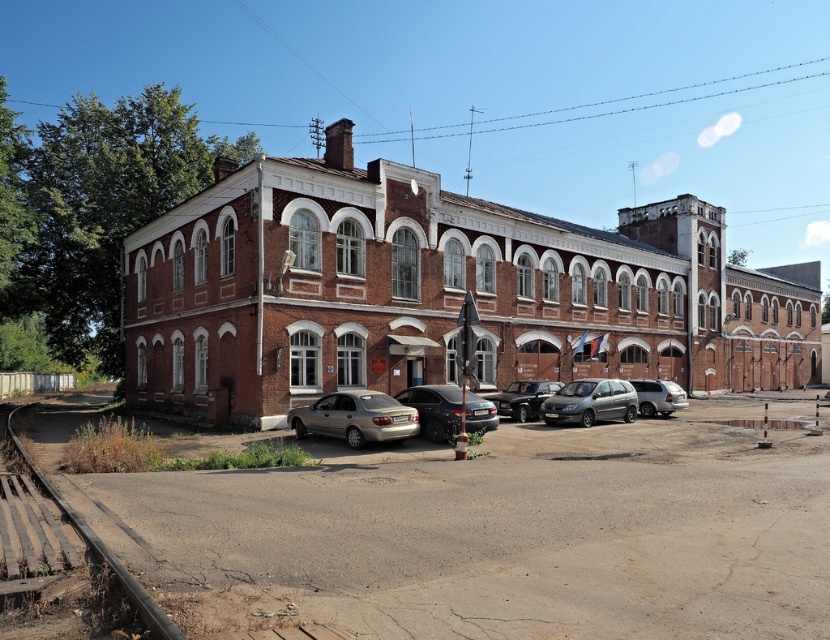
This screenshot has height=640, width=830. Describe the element at coordinates (433, 410) in the screenshot. I see `satin black sedan at center` at that location.

Is point (427, 429) farther from camera compared to point (66, 513)?

Yes, point (427, 429) is behind point (66, 513).

What do you see at coordinates (433, 410) in the screenshot? I see `satin black sedan at center` at bounding box center [433, 410].

This screenshot has width=830, height=640. I want to click on satin black sedan at center, so click(x=433, y=410).

Does gold metallic sedan at center have a smaller size compared to satin black sedan at center?

Incorrect, gold metallic sedan at center is not smaller in size than satin black sedan at center.

Who is positioned more to the right, gold metallic sedan at center or satin black sedan at center?

satin black sedan at center

Measure the distance between point (369, 408) and camera.

Point (369, 408) is 63.11 feet from camera.

Image resolution: width=830 pixels, height=640 pixels. Identify the location of gold metallic sedan at center. point(355,417).

Is point (450, 392) more distant than point (506, 396)?

No, it is not.

Can you confirm if satin black sedan at center is shorter than shiny silver sedan at center?

No, satin black sedan at center is not shorter than shiny silver sedan at center.

Between point (403, 388) and point (531, 404), which one is positioned behind?

Point (531, 404)

Image resolution: width=830 pixels, height=640 pixels. I want to click on satin black sedan at center, so click(433, 410).